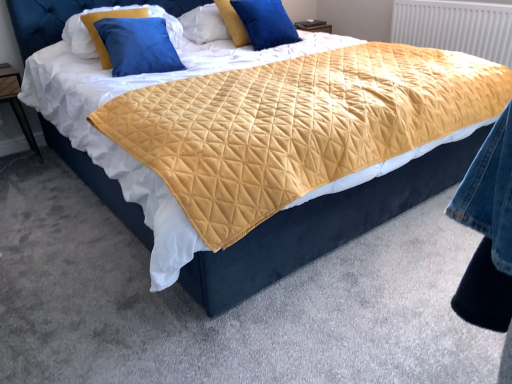
This screenshot has width=512, height=384. What are the coordinates of `yellow quilted pillow at upper center, the first pillow from the right` in the screenshot? It's located at (257, 23).

This screenshot has width=512, height=384. What do you see at coordinates (113, 11) in the screenshot?
I see `blue velvet pillow at upper left, marked as the second pillow in a right-to-left arrangement` at bounding box center [113, 11].

Find the location of a particular element. The width and height of the screenshot is (512, 384). wooden nightstand at left is located at coordinates (16, 103).

Could you tell me if wooden nightstand at left is turned towards yellow quilted radiator at upper right?

No, wooden nightstand at left is not turned towards yellow quilted radiator at upper right.

Is wooden nightstand at left with yellow quilted radiator at upper right?

wooden nightstand at left is not next to yellow quilted radiator at upper right, and they're not touching.

Which is less distant, (15, 88) or (423, 6)?

The point (15, 88) is closer.

Can you confirm if wooden nightstand at left is positioned to the left of yellow quilted radiator at upper right?

Indeed, wooden nightstand at left is positioned on the left side of yellow quilted radiator at upper right.

Which is more to the right, yellow quilted pillow at upper center, which ranks as the 2th pillow in left-to-right order, or yellow quilted radiator at upper right?

yellow quilted radiator at upper right is more to the right.

Can you confirm if yellow quilted pillow at upper center, the first pillow from the right, is shorter than yellow quilted radiator at upper right?

Yes.

Locate an element on the screen. This screenshot has height=384, width=512. radiator on the right of yellow quilted pillow at upper center, the first pillow from the right is located at coordinates (x=455, y=27).

Based on the photo, can we say yellow quilted pillow at upper center, the first pillow from the right, lies outside yellow quilted radiator at upper right?

Yes.

Can you confirm if yellow quilted radiator at upper right is smaller than yellow quilted pillow at upper center, the first pillow from the right?

No.

What are the coordinates of `radiator behind the yellow quilted pillow at upper center, which ranks as the 2th pillow in left-to-right order` in the screenshot? It's located at (455, 27).

From a real-world perspective, who is located lower, yellow quilted radiator at upper right or yellow quilted pillow at upper center, the first pillow from the right?

From a 3D spatial view, yellow quilted radiator at upper right is below.

Between yellow quilted radiator at upper right and yellow quilted pillow at upper center, the first pillow from the right, which one has more height?

With more height is yellow quilted radiator at upper right.

Considering the sizes of objects yellow quilted radiator at upper right and wooden nightstand at left in the image provided, who is thinner, yellow quilted radiator at upper right or wooden nightstand at left?

yellow quilted radiator at upper right.

Is yellow quilted radiator at upper right not near wooden nightstand at left?

Yes, yellow quilted radiator at upper right is far from wooden nightstand at left.

Would you say yellow quilted radiator at upper right contains wooden nightstand at left?

Definitely not — wooden nightstand at left is not inside yellow quilted radiator at upper right.

Find the location of a particular element. This screenshot has height=384, width=512. radiator behind the wooden nightstand at left is located at coordinates click(455, 27).

Is point (178, 21) closer or farther from the camera than point (282, 20)?

Point (178, 21) appears to be farther away from the viewer than point (282, 20).

Between blue velvet pillow at upper left, arranged as the first pillow when viewed from the left, and yellow quilted pillow at upper center, which ranks as the 2th pillow in left-to-right order, which one has smaller size?

Smaller between the two is yellow quilted pillow at upper center, which ranks as the 2th pillow in left-to-right order.

Is blue velvet pillow at upper left, marked as the second pillow in a right-to-left arrangement, oriented towards yellow quilted pillow at upper center, the first pillow from the right?

No, blue velvet pillow at upper left, marked as the second pillow in a right-to-left arrangement, is not oriented towards yellow quilted pillow at upper center, the first pillow from the right.

Is blue velvet pillow at upper left, marked as the second pillow in a right-to-left arrangement, further to camera compared to yellow quilted pillow at upper center, which ranks as the 2th pillow in left-to-right order?

No, it is not.

I want to click on the 2nd pillow positioned above the wooden nightstand at left (from a real-world perspective), so click(x=113, y=11).

How different are the orientations of wooden nightstand at left and blue velvet pillow at upper left, marked as the second pillow in a right-to-left arrangement, in degrees?

3.17 degrees separate the facing orientations of wooden nightstand at left and blue velvet pillow at upper left, marked as the second pillow in a right-to-left arrangement.

Is wooden nightstand at left facing away from blue velvet pillow at upper left, marked as the second pillow in a right-to-left arrangement?

No, blue velvet pillow at upper left, marked as the second pillow in a right-to-left arrangement, is not at the back of wooden nightstand at left.

From a real-world perspective, which is physically above, wooden nightstand at left or blue velvet pillow at upper left, arranged as the first pillow when viewed from the left?

From a 3D spatial view, blue velvet pillow at upper left, arranged as the first pillow when viewed from the left, is above.

From a real-world perspective, is wooden nightstand at left beneath yellow quilted pillow at upper center, the first pillow from the right?

Yes.

Is wooden nightstand at left turned away from yellow quilted pillow at upper center, the first pillow from the right?

No, wooden nightstand at left is not facing away from yellow quilted pillow at upper center, the first pillow from the right.

Identify the location of the 2nd pillow to the right of the wooden nightstand at left, starting your count from the anchor. The image size is (512, 384). (257, 23).

How distant is wooden nightstand at left from yellow quilted pillow at upper center, the first pillow from the right?

wooden nightstand at left and yellow quilted pillow at upper center, the first pillow from the right, are 5.50 feet apart.

The width and height of the screenshot is (512, 384). Find the location of `nightstand below the yellow quilted radiator at upper right (from the image's perspective)`. nightstand below the yellow quilted radiator at upper right (from the image's perspective) is located at coordinates (16, 103).

Starting from the yellow quilted radiator at upper right, which pillow is the 1st one to the left? Please provide its 2D coordinates.

[(257, 23)]

From the image, which object appears to be farther from yellow quilted pillow at upper center, the first pillow from the right, yellow quilted radiator at upper right or blue velvet pillow at upper left, marked as the second pillow in a right-to-left arrangement?

yellow quilted radiator at upper right is positioned further to the anchor yellow quilted pillow at upper center, the first pillow from the right.

From the image, which object appears to be farther from yellow quilted pillow at upper center, the first pillow from the right, yellow quilted radiator at upper right or wooden nightstand at left?

The object further to yellow quilted pillow at upper center, the first pillow from the right, is wooden nightstand at left.

Estimate the real-world distances between objects in this image. Which object is closer to blue velvet pillow at upper left, marked as the second pillow in a right-to-left arrangement, yellow quilted radiator at upper right or wooden nightstand at left?

The object closer to blue velvet pillow at upper left, marked as the second pillow in a right-to-left arrangement, is wooden nightstand at left.

Based on their spatial positions, is yellow quilted radiator at upper right or yellow quilted pillow at upper center, the first pillow from the right, closer to blue velvet pillow at upper left, arranged as the first pillow when viewed from the left?

yellow quilted pillow at upper center, the first pillow from the right.

Estimate the real-world distances between objects in this image. Which object is closer to wooden nightstand at left, yellow quilted pillow at upper center, which ranks as the 2th pillow in left-to-right order, or blue velvet pillow at upper left, arranged as the first pillow when viewed from the left?

blue velvet pillow at upper left, arranged as the first pillow when viewed from the left, lies closer to wooden nightstand at left than the other object.

Estimate the real-world distances between objects in this image. Which object is closer to yellow quilted pillow at upper center, which ranks as the 2th pillow in left-to-right order, wooden nightstand at left or yellow quilted radiator at upper right?

yellow quilted radiator at upper right lies closer to yellow quilted pillow at upper center, which ranks as the 2th pillow in left-to-right order, than the other object.

Considering their positions, is wooden nightstand at left positioned closer to yellow quilted radiator at upper right than blue velvet pillow at upper left, marked as the second pillow in a right-to-left arrangement?

Among the two, blue velvet pillow at upper left, marked as the second pillow in a right-to-left arrangement, is located nearer to yellow quilted radiator at upper right.

Looking at the image, which one is located further to yellow quilted radiator at upper right, blue velvet pillow at upper left, marked as the second pillow in a right-to-left arrangement, or yellow quilted pillow at upper center, which ranks as the 2th pillow in left-to-right order?

blue velvet pillow at upper left, marked as the second pillow in a right-to-left arrangement, is positioned further to the anchor yellow quilted radiator at upper right.

You are a GUI agent. You are given a task and a screenshot of the screen. Output one action in this format:
    pyautogui.click(x=<x>, y=<y>)
    Task: Click on the pillow between blue velvet pillow at upper left, arranged as the first pillow when viewed from the left, and yellow quilted radiator at upper right from left to right
    Image resolution: width=512 pixels, height=384 pixels.
    Given the screenshot: What is the action you would take?
    pyautogui.click(x=257, y=23)

Locate an element on the screen. pillow located between wooden nightstand at left and yellow quilted pillow at upper center, the first pillow from the right, in the left-right direction is located at coordinates (113, 11).